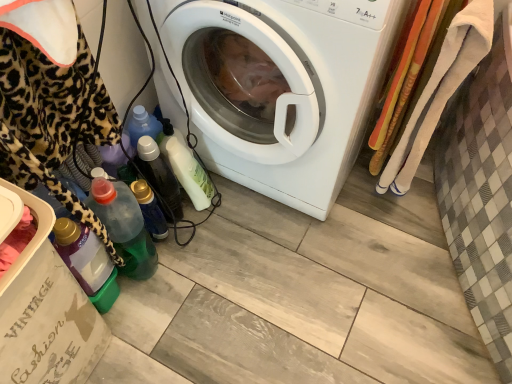
Question: Can you confirm if translucent plastic bottle at lower left, the fourth bottle from the right, is wider than green translucent bottle at lower left, which appears as the 5th bottle when viewed from the right?

Choices:
 (A) no
 (B) yes

Answer: (A)

Question: Is translucent plastic bottle at lower left, the second bottle positioned from the left, facing away from green translucent bottle at lower left, arranged as the first bottle when viewed from the left?

Choices:
 (A) no
 (B) yes

Answer: (B)

Question: From the image's perspective, would you say translucent plastic bottle at lower left, the second bottle positioned from the left, is shown under green translucent bottle at lower left, arranged as the first bottle when viewed from the left?

Choices:
 (A) yes
 (B) no

Answer: (B)

Question: Can you confirm if translucent plastic bottle at lower left, the second bottle positioned from the left, is shorter than green translucent bottle at lower left, which appears as the 5th bottle when viewed from the right?

Choices:
 (A) yes
 (B) no

Answer: (B)

Question: Is translucent plastic bottle at lower left, the second bottle positioned from the left, thinner than green translucent bottle at lower left, which appears as the 5th bottle when viewed from the right?

Choices:
 (A) yes
 (B) no

Answer: (A)

Question: Is green translucent bottle at lower left, arranged as the first bottle when viewed from the left, bigger or smaller than translucent plastic bottle at lower center, placed as the 1th bottle when sorted from right to left?

Choices:
 (A) big
 (B) small

Answer: (B)

Question: Is point (100, 284) closer or farther from the camera than point (187, 162)?

Choices:
 (A) farther
 (B) closer

Answer: (B)

Question: Choose the correct answer: Is green translucent bottle at lower left, arranged as the first bottle when viewed from the left, inside translucent plastic bottle at lower center, placed as the 1th bottle when sorted from right to left, or outside it?

Choices:
 (A) inside
 (B) outside

Answer: (B)

Question: Visually, is green translucent bottle at lower left, which appears as the 5th bottle when viewed from the right, positioned to the left or to the right of translucent plastic bottle at lower center, placed as the 1th bottle when sorted from right to left?

Choices:
 (A) left
 (B) right

Answer: (A)

Question: Is matte cardboard box at lower left in front of or behind translucent plastic bottle at lower left, which appears as the third bottle when viewed from the left, in the image?

Choices:
 (A) front
 (B) behind

Answer: (A)

Question: Is matte cardboard box at lower left bigger or smaller than translucent plastic bottle at lower left, which appears as the third bottle when viewed from the left?

Choices:
 (A) big
 (B) small

Answer: (A)

Question: Is matte cardboard box at lower left spatially inside translucent plastic bottle at lower left, which appears as the third bottle when viewed from the left, or outside of it?

Choices:
 (A) outside
 (B) inside

Answer: (A)

Question: Considering the positions of matte cardboard box at lower left and translucent plastic bottle at lower left, arranged as the 3th bottle when viewed from the right, in the image, is matte cardboard box at lower left wider or thinner than translucent plastic bottle at lower left, arranged as the 3th bottle when viewed from the right,?

Choices:
 (A) thin
 (B) wide

Answer: (B)

Question: Is green translucent bottle at lower left, which appears as the 5th bottle when viewed from the right, to the left or to the right of matte cardboard box at lower left in the image?

Choices:
 (A) left
 (B) right

Answer: (B)

Question: Considering the positions of green translucent bottle at lower left, which appears as the 5th bottle when viewed from the right, and matte cardboard box at lower left in the image, is green translucent bottle at lower left, which appears as the 5th bottle when viewed from the right, wider or thinner than matte cardboard box at lower left?

Choices:
 (A) thin
 (B) wide

Answer: (A)